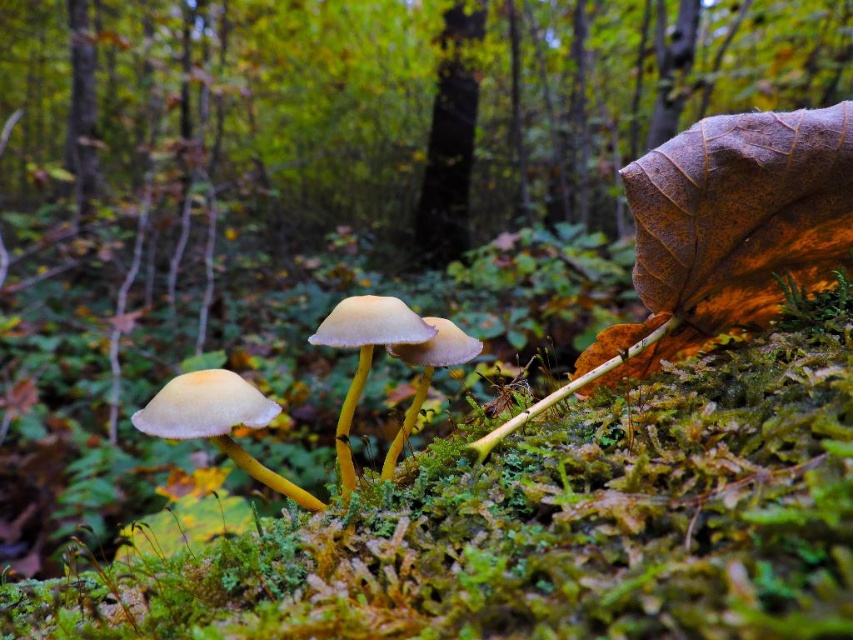
Does point (399, 147) come closer to viewer compared to point (450, 132)?

That is True.

Image resolution: width=853 pixels, height=640 pixels. In order to click on brown leaf at upper right in this screenshot , I will do `click(393, 99)`.

Is point (395, 19) farther from camera compared to point (457, 182)?

Yes, it is behind point (457, 182).

Find the location of a particular element. The width and height of the screenshot is (853, 640). brown leaf at upper right is located at coordinates (393, 99).